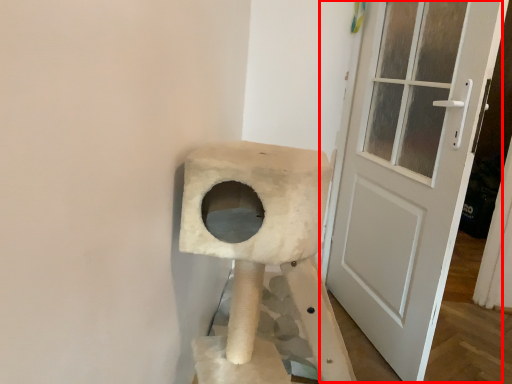
Question: Considering the relative positions of door (annotated by the red box) and cat furniture in the image provided, where is door (annotated by the red box) located with respect to the staircase?

Choices:
 (A) right
 (B) left

Answer: (A)